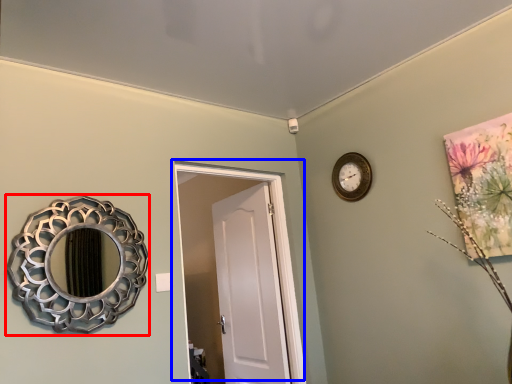
Question: Which point is closer to the camera, mirror (highlighted by a red box) or door (highlighted by a blue box)?

Choices:
 (A) mirror
 (B) door

Answer: (A)